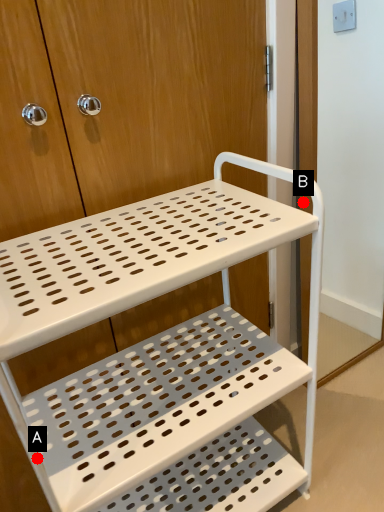
Question: Two points are circled on the image, labeled by A and B beside each circle. Which of the following is the closest to the observer?

Choices:
 (A) A is closer
 (B) B is closer

Answer: (A)